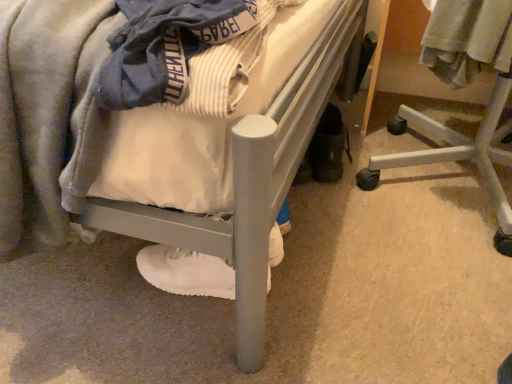
Question: Based on their positions, is white plastic chair at lower right located to the left or right of light gray cotton shirt at upper right?

Choices:
 (A) left
 (B) right

Answer: (B)

Question: Looking at their shapes, would you say white plastic chair at lower right is wider or thinner than light gray cotton shirt at upper right?

Choices:
 (A) thin
 (B) wide

Answer: (B)

Question: Estimate the real-world distances between objects in this image. Which object is closer to the matte gray bed at center?

Choices:
 (A) white matte sneaker at lower center
 (B) white plastic chair at lower right
 (C) light gray cotton shirt at upper right

Answer: (A)

Question: Which object is the closest to the matte gray bed at center?

Choices:
 (A) white plastic chair at lower right
 (B) white matte sneaker at lower center
 (C) light gray cotton shirt at upper right

Answer: (B)